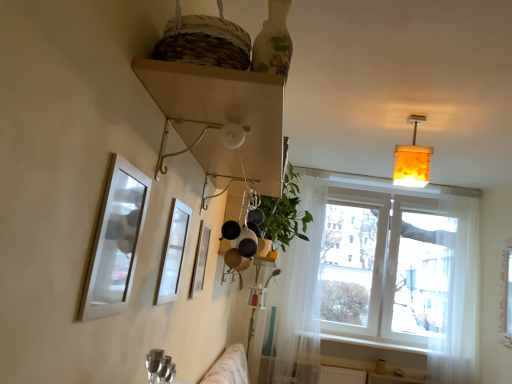
What do you see at coordinates (373, 344) in the screenshot? I see `white smooth window sill at lower right` at bounding box center [373, 344].

The height and width of the screenshot is (384, 512). What do you see at coordinates (173, 253) in the screenshot? I see `white glossy picture frame at upper center, acting as the 2th picture frame starting from the front` at bounding box center [173, 253].

Describe the element at coordinates (200, 261) in the screenshot. Image resolution: width=512 pixels, height=384 pixels. I see `metallic silver picture frame at center, the third picture frame from the front` at that location.

How much space does white sheer curtain at right, placed as the 1th curtain when sorted from right to left, occupy vertically?

5.58 feet.

Image resolution: width=512 pixels, height=384 pixels. Describe the element at coordinates (458, 296) in the screenshot. I see `white sheer curtain at right, marked as the second curtain in a left-to-right arrangement` at that location.

At what (x,y) coordinates should I click in order to perform the action: click on white smooth window sill at lower right. Please return your answer as a coordinate pair (x, y). The image size is (512, 384). Looking at the image, I should click on (373, 344).

Which of these two, white glossy picture frame at upper center, acting as the 2th picture frame starting from the front, or wooden shelf at upper center, is wider?

wooden shelf at upper center is wider.

From a real-world perspective, does white glossy picture frame at upper center, acting as the 2th picture frame starting from the front, sit lower than wooden shelf at upper center?

Yes, from a real-world perspective, white glossy picture frame at upper center, acting as the 2th picture frame starting from the front, is beneath wooden shelf at upper center.

Which point is more distant from viewer, (185,232) or (256,117)?

The point (185,232) is farther from the camera.

Does white glossy picture frame at upper center, acting as the 2th picture frame starting from the front, have a lesser height compared to wooden shelf at upper center?

In fact, white glossy picture frame at upper center, acting as the 2th picture frame starting from the front, may be taller than wooden shelf at upper center.

Based on the photo, considering the sizes of objects translucent amber glass lampshade at upper right and white smooth window sill at lower right in the image provided, who is smaller, translucent amber glass lampshade at upper right or white smooth window sill at lower right?

white smooth window sill at lower right is smaller.

Identify the location of window sill below the translucent amber glass lampshade at upper right (from a real-world perspective). (373, 344).

Are translucent amber glass lampshade at upper right and white smooth window sill at lower right making contact?

No, translucent amber glass lampshade at upper right is not beside white smooth window sill at lower right.

From the image's perspective, which one is positioned lower, translucent amber glass lampshade at upper right or white smooth window sill at lower right?

white smooth window sill at lower right.

In order to click on the 1st curtain counting from the right side of the matte white picture frame at left, arranged as the 1th picture frame when viewed from the front in this screenshot , I will do `click(297, 302)`.

From their relative heights in the image, would you say translucent white curtain at center, arranged as the 2th curtain when viewed from the right, is taller or shorter than matte white picture frame at left, the 3th picture frame in the back-to-front sequence?

In the image, translucent white curtain at center, arranged as the 2th curtain when viewed from the right, appears to be taller than matte white picture frame at left, the 3th picture frame in the back-to-front sequence.

Which point is more distant from viewer, (x=308, y=262) or (x=108, y=259)?

Positioned behind is point (x=308, y=262).

Is translucent white curtain at center, arranged as the 2th curtain when viewed from the right, far from matte white picture frame at left, arranged as the 1th picture frame when viewed from the front?

Yes, translucent white curtain at center, arranged as the 2th curtain when viewed from the right, and matte white picture frame at left, arranged as the 1th picture frame when viewed from the front, are located far from each other.

From the image's perspective, who appears lower, transparent fabric at right or green leafy plant at center?

transparent fabric at right is shown below in the image.

From a real-world perspective, is transparent fabric at right above or below green leafy plant at center?

In terms of real-world spatial position, transparent fabric at right is below green leafy plant at center.

In the scene shown: Which object is closer to the camera taking this photo, transparent fabric at right or green leafy plant at center?

green leafy plant at center.

Is matte white picture frame at left, the 3th picture frame in the back-to-front sequence, aimed at translucent white curtain at center, the 1th curtain viewed from the left?

No, matte white picture frame at left, the 3th picture frame in the back-to-front sequence, is not oriented towards translucent white curtain at center, the 1th curtain viewed from the left.

Is the position of matte white picture frame at left, the 3th picture frame in the back-to-front sequence, less distant than that of translucent white curtain at center, arranged as the 2th curtain when viewed from the right?

Yes, it is.

Measure the distance from matte white picture frame at left, arranged as the 1th picture frame when viewed from the front, to translucent white curtain at center, the 1th curtain viewed from the left.

A distance of 2.85 meters exists between matte white picture frame at left, arranged as the 1th picture frame when viewed from the front, and translucent white curtain at center, the 1th curtain viewed from the left.

Where is `curtain that is the 1st one when counting downward from the matte white picture frame at left, arranged as the 1th picture frame when viewed from the front (from the image's perspective)`? curtain that is the 1st one when counting downward from the matte white picture frame at left, arranged as the 1th picture frame when viewed from the front (from the image's perspective) is located at coordinates (297, 302).

Which of these two, wooden shelf at upper center or green leafy plant at center, stands taller?

green leafy plant at center.

From a real-world perspective, relative to green leafy plant at center, is wooden shelf at upper center vertically above or below?

In terms of real-world spatial position, wooden shelf at upper center is below green leafy plant at center.

Which of these two, wooden shelf at upper center or green leafy plant at center, is smaller?

With smaller size is green leafy plant at center.

Is the surface of translucent white curtain at center, the 1th curtain viewed from the left, in direct contact with white glossy picture frame at upper center, acting as the 2th picture frame starting from the front?

There is a gap between translucent white curtain at center, the 1th curtain viewed from the left, and white glossy picture frame at upper center, acting as the 2th picture frame starting from the front.

Is translucent white curtain at center, arranged as the 2th curtain when viewed from the right, thinner than white glossy picture frame at upper center, the second picture frame from the back?

No, translucent white curtain at center, arranged as the 2th curtain when viewed from the right, is not thinner than white glossy picture frame at upper center, the second picture frame from the back.

From the image's perspective, is translucent white curtain at center, the 1th curtain viewed from the left, beneath white glossy picture frame at upper center, the second picture frame from the back?

Yes, from the image's perspective, translucent white curtain at center, the 1th curtain viewed from the left, is beneath white glossy picture frame at upper center, the second picture frame from the back.

The height and width of the screenshot is (384, 512). There is a white glossy picture frame at upper center, acting as the 2th picture frame starting from the front. In order to click on shelf above it (from a real-world perspective) in this screenshot , I will do `click(222, 117)`.

Identify the location of window sill that is under the translucent amber glass lampshade at upper right (from a real-world perspective). The height and width of the screenshot is (384, 512). (373, 344).

Based on their spatial positions, is white glossy picture frame at upper center, acting as the 2th picture frame starting from the front, or transparent fabric at right closer to metallic silver picture frame at center, the 1th picture frame in the back-to-front sequence?

white glossy picture frame at upper center, acting as the 2th picture frame starting from the front, is closer to metallic silver picture frame at center, the 1th picture frame in the back-to-front sequence.

Based on their spatial positions, is translucent white curtain at center, the 1th curtain viewed from the left, or white sheer curtain at right, marked as the second curtain in a left-to-right arrangement, further from green leafy plant at center?

Among the two, white sheer curtain at right, marked as the second curtain in a left-to-right arrangement, is located further to green leafy plant at center.

Consider the image. When comparing their distances from translucent amber glass lampshade at upper right, does translucent white curtain at center, arranged as the 2th curtain when viewed from the right, or transparent fabric at right seem further?

translucent white curtain at center, arranged as the 2th curtain when viewed from the right, is further to translucent amber glass lampshade at upper right.

Considering their positions, is wooden shelf at upper center positioned closer to green leafy plant at center than white glossy picture frame at upper center, acting as the 2th picture frame starting from the front?

wooden shelf at upper center lies closer to green leafy plant at center than the other object.

Estimate the real-world distances between objects in this image. Which object is closer to green leafy plant at center, white smooth window sill at lower right or metallic silver picture frame at center, the 1th picture frame in the back-to-front sequence?

metallic silver picture frame at center, the 1th picture frame in the back-to-front sequence.

Estimate the real-world distances between objects in this image. Which object is further from white sheer curtain at right, marked as the second curtain in a left-to-right arrangement, transparent fabric at right or matte white picture frame at left, the 3th picture frame in the back-to-front sequence?

matte white picture frame at left, the 3th picture frame in the back-to-front sequence, is positioned further to the anchor white sheer curtain at right, marked as the second curtain in a left-to-right arrangement.

In the scene shown: Based on their spatial positions, is translucent white curtain at center, arranged as the 2th curtain when viewed from the right, or white sheer curtain at right, placed as the 1th curtain when sorted from right to left, further from translucent amber glass lampshade at upper right?

white sheer curtain at right, placed as the 1th curtain when sorted from right to left, is positioned further to the anchor translucent amber glass lampshade at upper right.

Based on their spatial positions, is wooden shelf at upper center or translucent amber glass lampshade at upper right further from transparent fabric at right?

wooden shelf at upper center lies further to transparent fabric at right than the other object.

Where is `lamp between white glossy picture frame at upper center, acting as the 2th picture frame starting from the front, and translucent white curtain at center, the 1th curtain viewed from the left, from front to back`? This screenshot has height=384, width=512. lamp between white glossy picture frame at upper center, acting as the 2th picture frame starting from the front, and translucent white curtain at center, the 1th curtain viewed from the left, from front to back is located at coordinates (412, 160).

Where is `lamp positioned between wooden shelf at upper center and green leafy plant at center from near to far`? This screenshot has height=384, width=512. lamp positioned between wooden shelf at upper center and green leafy plant at center from near to far is located at coordinates (412, 160).

You are a GUI agent. You are given a task and a screenshot of the screen. Output one action in this format:
    pyautogui.click(x=<x>, y=<y>)
    Task: Click on the lamp between white glossy picture frame at upper center, the second picture frame from the back, and transparent fabric at right, in the horizontal direction
    
    Given the screenshot: What is the action you would take?
    pyautogui.click(x=412, y=160)

You are a GUI agent. You are given a task and a screenshot of the screen. Output one action in this format:
    pyautogui.click(x=<x>, y=<y>)
    Task: Click on the lamp between green leafy plant at center and white sheer curtain at right, placed as the 1th curtain when sorted from right to left, from left to right
    The height and width of the screenshot is (384, 512).
    Given the screenshot: What is the action you would take?
    pyautogui.click(x=412, y=160)